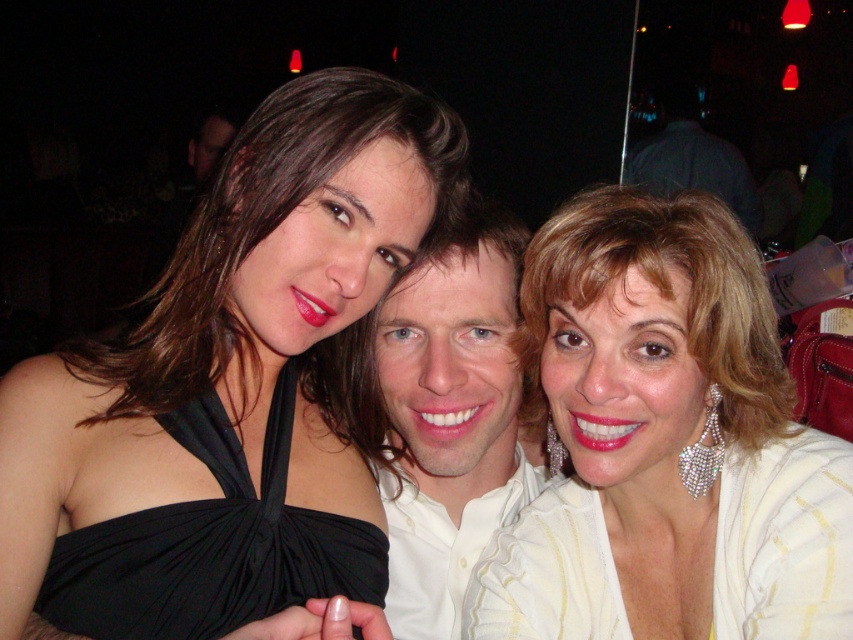
Between point (691, 554) and point (518, 342), which one is positioned in front?

Point (691, 554) is in front.

Measure the distance between white satin blouse at right and camera.

white satin blouse at right is 63.64 centimeters away from camera.

Locate an element on the screen. This screenshot has height=640, width=853. white satin blouse at right is located at coordinates (665, 444).

Consider the image. Who is more distant from viewer, [216,301] or [465,352]?

The point [465,352] is behind.

Between black satin dress at center and white smooth shirt at center, which one appears on the right side from the viewer's perspective?

white smooth shirt at center

Where is `black satin dress at center`? This screenshot has width=853, height=640. black satin dress at center is located at coordinates (231, 394).

Is black satin dress at center thinner than black satin dress at left?

No.

Can you confirm if black satin dress at center is smaller than black satin dress at left?

No.

What do you see at coordinates (231, 394) in the screenshot? The image size is (853, 640). I see `black satin dress at center` at bounding box center [231, 394].

At what (x,y) coordinates should I click in order to perform the action: click on black satin dress at center. Please return your answer as a coordinate pair (x, y). The image size is (853, 640). Looking at the image, I should click on (231, 394).